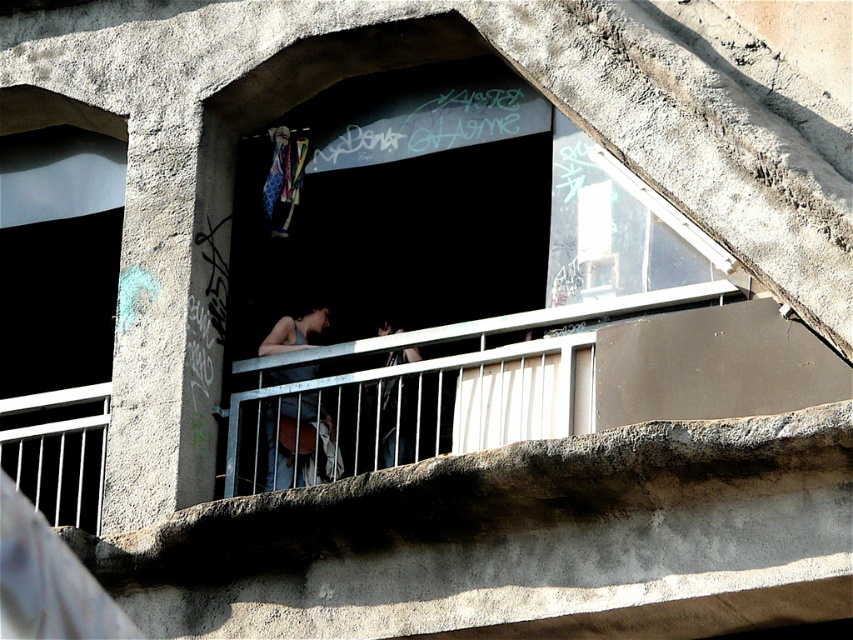
Question: Is transparent glass window at left in front of dark blue denim jeans at center?

Choices:
 (A) yes
 (B) no

Answer: (A)

Question: Which of the following is the farthest from the observer?

Choices:
 (A) transparent glass window at left
 (B) dark blue denim jeans at center
 (C) dark blue jeans at center

Answer: (B)

Question: Does dark blue denim jeans at center appear on the right side of dark blue jeans at center?

Choices:
 (A) no
 (B) yes

Answer: (A)

Question: Among these points, which one is farthest from the camera?

Choices:
 (A) (410, 444)
 (B) (86, 468)
 (C) (311, 326)

Answer: (C)

Question: Does dark blue denim jeans at center have a larger size compared to dark blue jeans at center?

Choices:
 (A) yes
 (B) no

Answer: (B)

Question: Among these objects, which one is nearest to the camera?

Choices:
 (A) dark blue jeans at center
 (B) transparent glass window at left

Answer: (A)